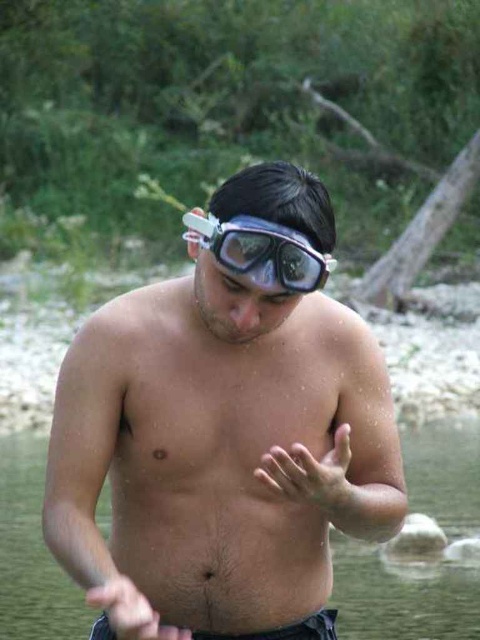
Who is higher up, transparent rubber goggles at center or smooth skin hand at center?

transparent rubber goggles at center is above.

Between transparent rubber goggles at center and smooth skin hand at center, which one appears on the left side from the viewer's perspective?

smooth skin hand at center is more to the left.

Which is behind, point (216, 256) or point (140, 611)?

Positioned behind is point (216, 256).

I want to click on transparent rubber goggles at center, so click(261, 252).

Between clear plastic goggles at center and smooth skin hand at center, which one is positioned higher?

clear plastic goggles at center is higher up.

Is clear plastic goggles at center shorter than smooth skin hand at center?

In fact, clear plastic goggles at center may be taller than smooth skin hand at center.

Where is `clear plastic goggles at center`? clear plastic goggles at center is located at coordinates (224, 420).

You are a GUI agent. You are given a task and a screenshot of the screen. Output one action in this format:
    pyautogui.click(x=<x>, y=<y>)
    Task: Click on the clear plastic goggles at center
    This screenshot has width=480, height=640.
    Given the screenshot: What is the action you would take?
    pyautogui.click(x=224, y=420)

Between clear plastic goggles at center and clear water at chest center, which one has less height?

With less height is clear plastic goggles at center.

Can you confirm if clear plastic goggles at center is wider than clear water at chest center?

No, clear plastic goggles at center is not wider than clear water at chest center.

Locate an element on the screen. The image size is (480, 640). clear plastic goggles at center is located at coordinates (224, 420).